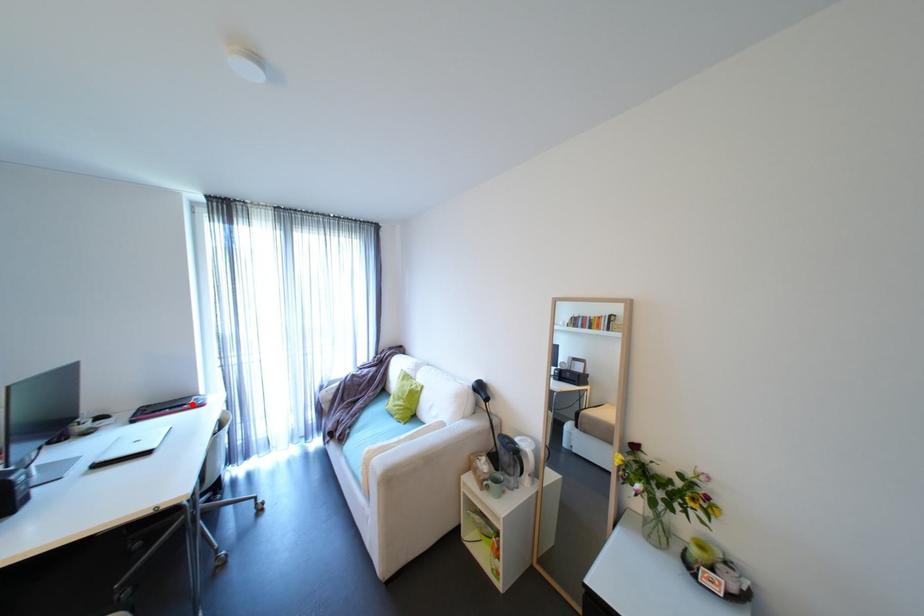
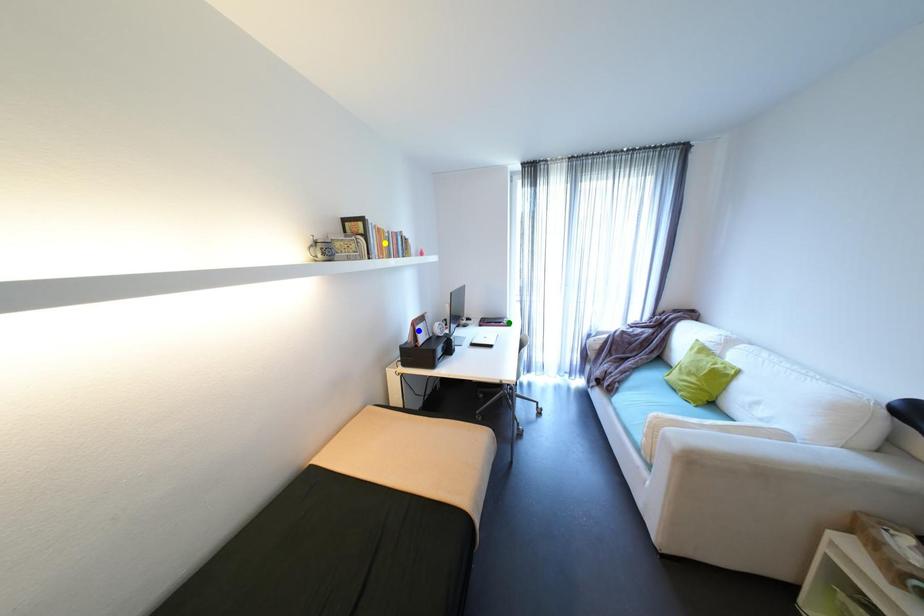
Question: I am providing you with two images of the same scene from different viewpoints. A red point is marked on the first image. You are given multiple points on the second image. Which point in image 2 represents the same 3d spot as the red point in image 1?

Choices:
 (A) yellow point
 (B) green point
 (C) blue point

Answer: (B)